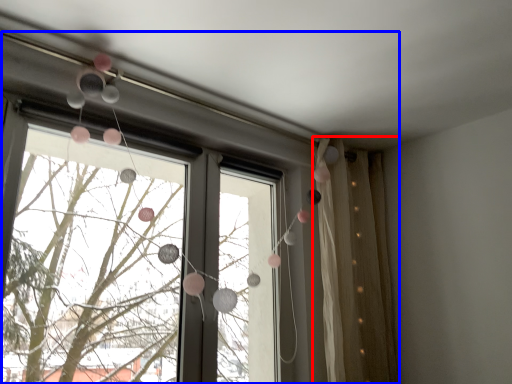
Question: Which object appears farthest to the camera in this image, curtain (highlighted by a red box) or window (highlighted by a blue box)?

Choices:
 (A) curtain
 (B) window

Answer: (A)